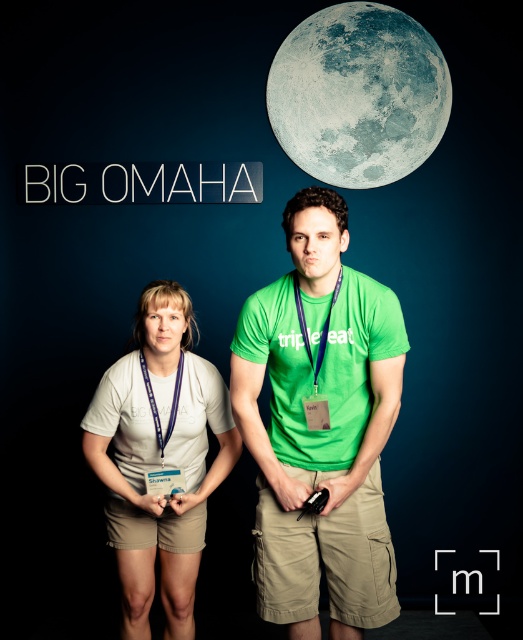
Question: Where is green matte shirt at center located in relation to white cotton t-shirt at center in the image?

Choices:
 (A) below
 (B) above

Answer: (B)

Question: Based on their relative distances, which object is farther from the white cotton t-shirt at center?

Choices:
 (A) gray textured moon at upper center
 (B) green matte shirt at center

Answer: (A)

Question: Which of the following is the closest to the observer?

Choices:
 (A) gray textured moon at upper center
 (B) green matte shirt at center

Answer: (B)

Question: Is white cotton t-shirt at center to the left of gray textured moon at upper center from the viewer's perspective?

Choices:
 (A) no
 (B) yes

Answer: (B)

Question: Does green matte shirt at center have a lesser width compared to gray textured moon at upper center?

Choices:
 (A) yes
 (B) no

Answer: (A)

Question: Which object is closer to the camera taking this photo?

Choices:
 (A) green matte shirt at center
 (B) gray textured moon at upper center
 (C) white cotton t-shirt at center

Answer: (A)